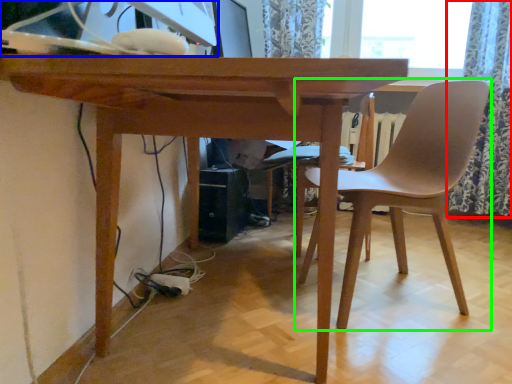
Question: Which is nearer to the curtain (highlighted by a red box)? desktop computer (highlighted by a blue box) or chair (highlighted by a green box).

Choices:
 (A) desktop computer
 (B) chair

Answer: (B)